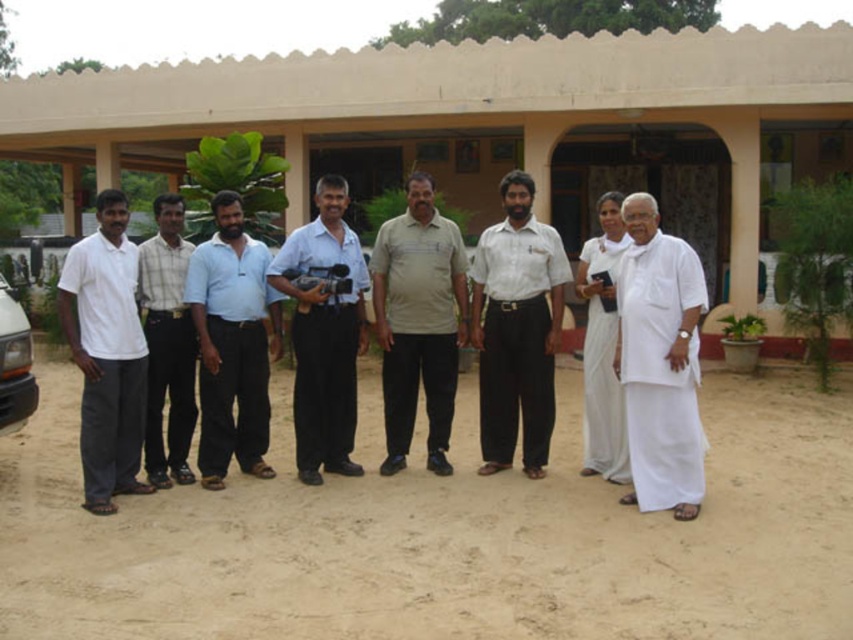
Can you confirm if white cotton shirt at center is thinner than white cloth at center?

In fact, white cotton shirt at center might be wider than white cloth at center.

Is white cotton shirt at center positioned before white cloth at center?

No, it is behind white cloth at center.

Which is in front, point (486, 380) or point (585, 436)?

Point (486, 380) is in front.

This screenshot has width=853, height=640. In order to click on white cotton shirt at center in this screenshot , I will do `click(515, 330)`.

Does point (500, 384) lie in front of point (447, 388)?

Yes, point (500, 384) is closer to viewer.

Can you confirm if white cotton shirt at center is thinner than beige cotton shirt at center?

Yes.

This screenshot has height=640, width=853. In order to click on white cotton shirt at center in this screenshot , I will do `click(515, 330)`.

Does light blue cotton shirt at center appear on the right side of blue shirt at center?

No, light blue cotton shirt at center is not to the right of blue shirt at center.

Where is `light blue cotton shirt at center`? Image resolution: width=853 pixels, height=640 pixels. light blue cotton shirt at center is located at coordinates (231, 342).

This screenshot has height=640, width=853. Describe the element at coordinates (231, 342) in the screenshot. I see `light blue cotton shirt at center` at that location.

This screenshot has height=640, width=853. What are the coordinates of `light blue cotton shirt at center` in the screenshot? It's located at (231, 342).